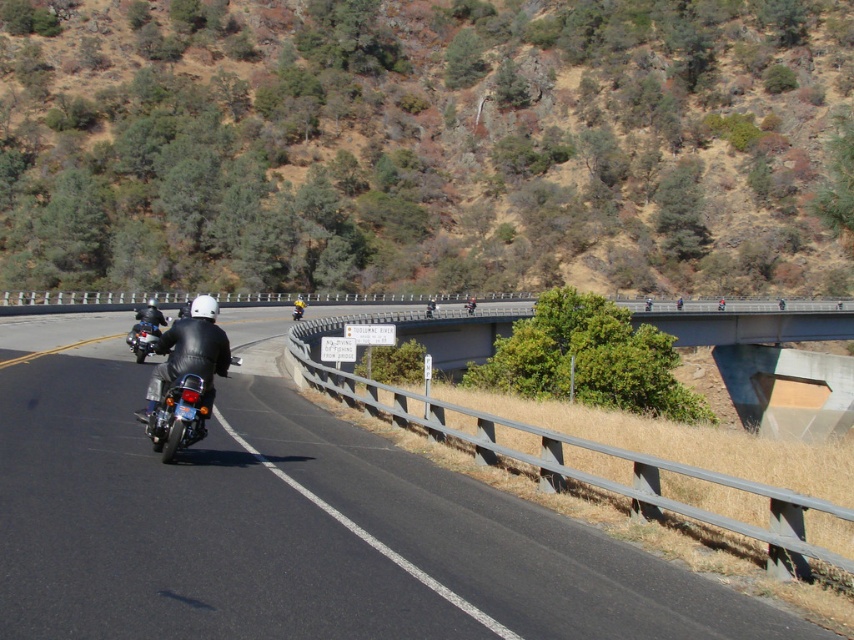
Question: Which object is positioned closest to the concrete bridge at upper center?

Choices:
 (A) black asphalt road at center
 (B) shiny black leather jacket at center
 (C) shiny chrome motorcycle at left

Answer: (A)

Question: Among these objects, which one is nearest to the camera?

Choices:
 (A) shiny chrome motorcycle at left
 (B) concrete bridge at upper center
 (C) black asphalt road at center
 (D) green leafy hillside at upper center

Answer: (C)

Question: Is green leafy hillside at upper center wider than concrete bridge at upper center?

Choices:
 (A) yes
 (B) no

Answer: (A)

Question: Does black asphalt road at center lie in front of concrete bridge at upper center?

Choices:
 (A) no
 (B) yes

Answer: (B)

Question: Which of the following is the closest to the observer?

Choices:
 (A) shiny black leather jacket at center
 (B) concrete bridge at upper center
 (C) black asphalt road at center

Answer: (C)

Question: Can you confirm if black asphalt road at center is positioned to the right of shiny black leather jacket at center?

Choices:
 (A) yes
 (B) no

Answer: (B)